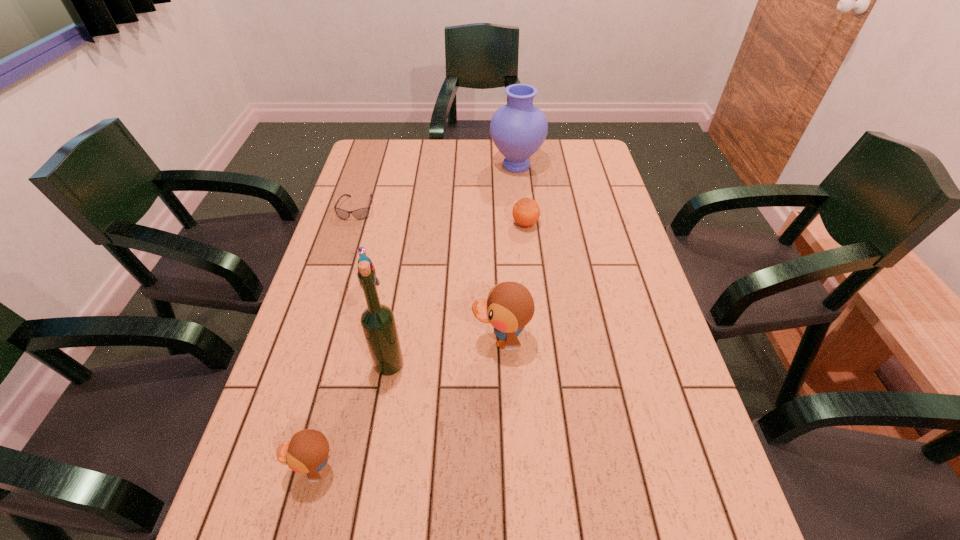
Where is `vacant place for an extra duck on the right`? The height and width of the screenshot is (540, 960). vacant place for an extra duck on the right is located at coordinates (627, 254).